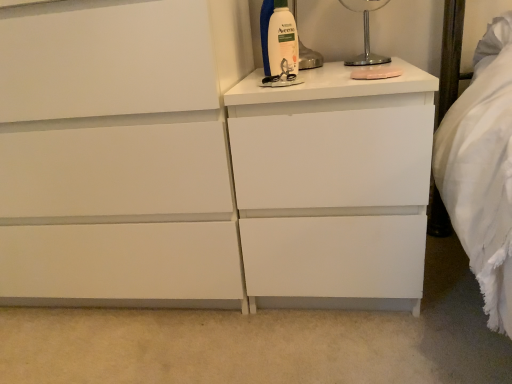
Where is `vacant space in front of white matte nightstand at center`? This screenshot has height=384, width=512. vacant space in front of white matte nightstand at center is located at coordinates (360, 346).